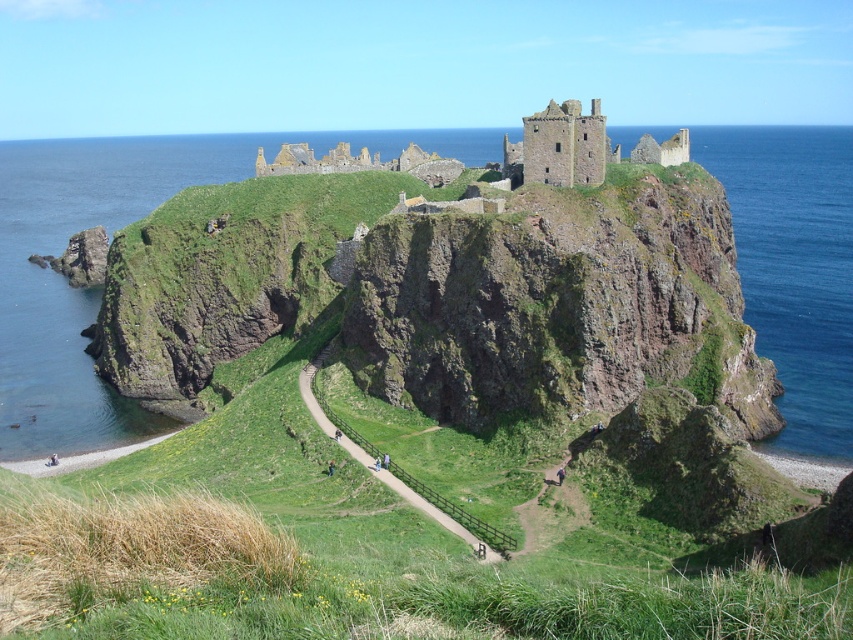
You are standing at the base of the Dunnottar Castle cliffs and want to reach the castle ruins. You see two points marked on your map as point 1 at coordinates (757, 307) and point 2 at coordinates (485, 524). Which point is closer to you as you start your climb?

Point 1 at coordinates (757, 307) is closer to you because it is further to the viewer than point 2 at coordinates (485, 524), meaning it is physically nearer to your starting position at the base of the cliffs.